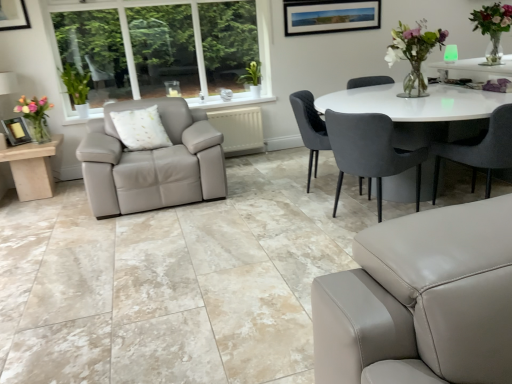
This screenshot has height=384, width=512. In order to click on vacant space underneath beige marble side table at left (from a real-world perspective) in this screenshot , I will do `click(38, 200)`.